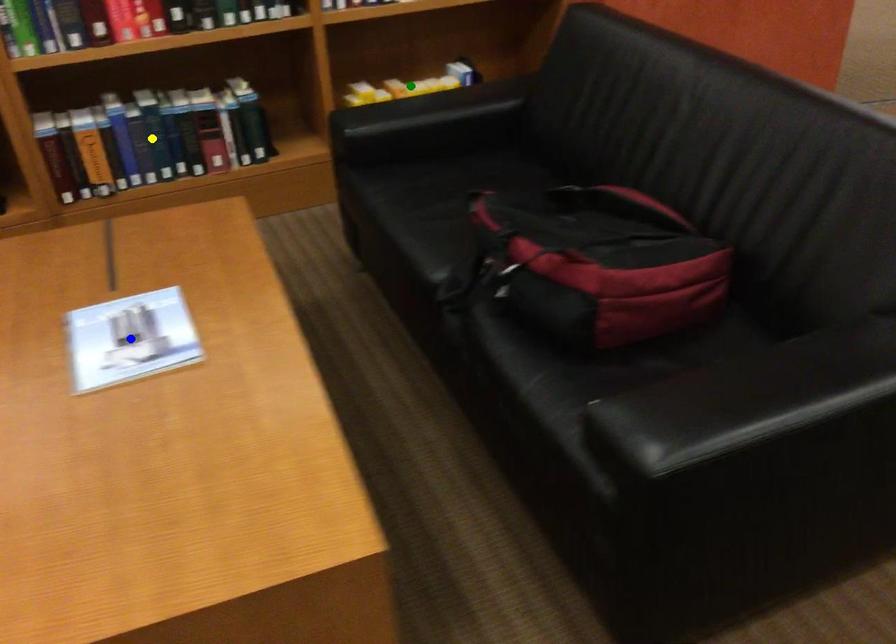
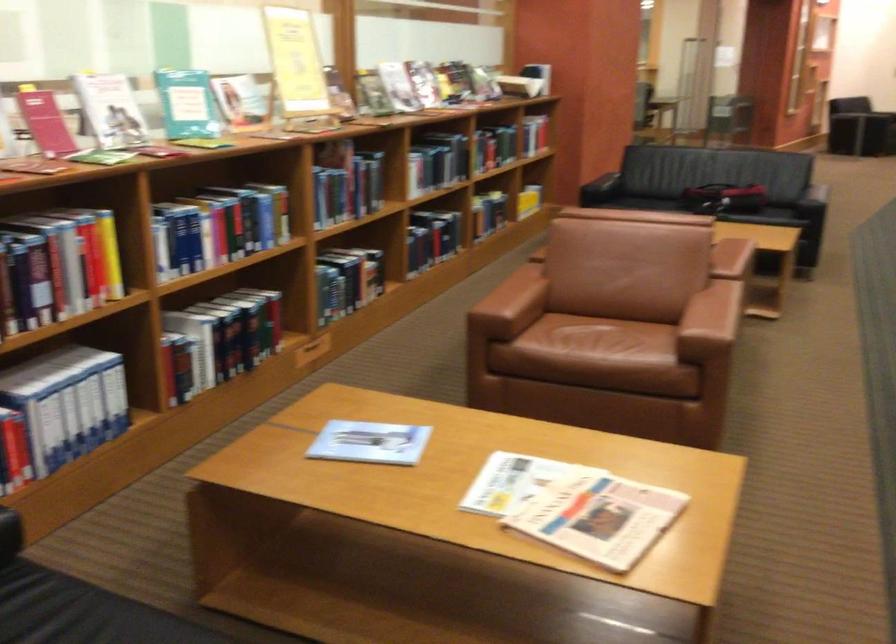
I am providing you with two images of the same scene from different viewpoints. Three points are marked in image1. Which point corresponds to a part or object that is occluded in image2?In image1, three points are marked. Which of them correspond to a part or object that is occluded in image2?Among the three points shown in image1, which one corresponds to a part or object that is no longer visible due to occlusion in image2?

Invisible in image2: blue point.